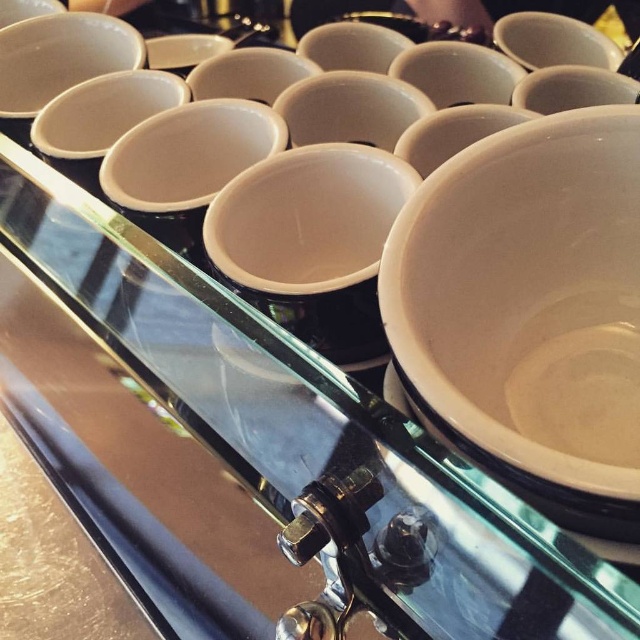
You are a barista preparing a dessert and have both the white matte bowl at center and the white glossy saucer at center. Which one can hold more whipped cream?

The white matte bowl at center can hold more whipped cream because it is bigger than the white glossy saucer at center.

You are standing in front of the coffee machine and want to reach both the point at coordinates point (13, 64) and the point at coordinates point (502, 45). Which point should you reach for first?

You should reach for the point at coordinates point (13, 64) first because it is closer to you than the point at coordinates point (502, 45).

You are a barista who needs to place a 12 inch long tray between the white glossy bowl at upper left and the white glossy bowl at upper right on the coffee machine. Will the tray fit in the space between them?

The distance between the white glossy bowl at upper left and white glossy bowl at upper right is 22.62 inches, which is greater than the 12 inch length of the tray. Therefore, the tray will fit between them.